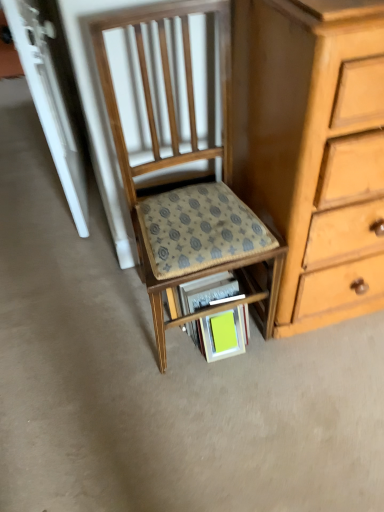
Question: In the image, is bright yellow paper at lower center on the left side or the right side of patterned fabric step stool at center?

Choices:
 (A) left
 (B) right

Answer: (B)

Question: Is bright yellow paper at lower center inside or outside of patterned fabric step stool at center?

Choices:
 (A) inside
 (B) outside

Answer: (A)

Question: Based on their relative distances, which object is nearer to the wooden chair at center?

Choices:
 (A) bright yellow paper at lower center
 (B) patterned fabric step stool at center

Answer: (B)

Question: Which object is positioned farthest from the wooden chair at center?

Choices:
 (A) patterned fabric step stool at center
 (B) bright yellow paper at lower center

Answer: (B)